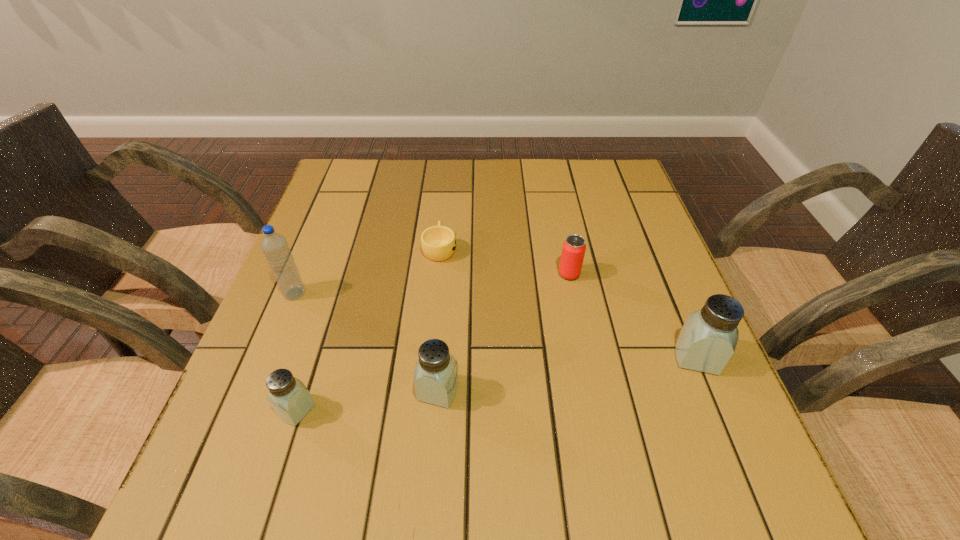
I want to click on the shortest saltshaker, so click(290, 399).

At what (x,y) coordinates should I click in order to perform the action: click on the leftmost saltshaker. Please return your answer as a coordinate pair (x, y). The image size is (960, 540). Looking at the image, I should click on pos(290,399).

Where is `the second saltshaker from left to right`? the second saltshaker from left to right is located at coordinates (436, 379).

I want to click on the third tallest object, so click(436, 379).

At what (x,y) coordinates should I click in order to perform the action: click on the second tallest object. Please return your answer as a coordinate pair (x, y). This screenshot has width=960, height=540. Looking at the image, I should click on (708, 338).

Identify the location of the tallest saltshaker. The height and width of the screenshot is (540, 960). (708, 338).

You are a GUI agent. You are given a task and a screenshot of the screen. Output one action in this format:
    pyautogui.click(x=<x>, y=<y>)
    Task: Click on the cup
    This screenshot has width=960, height=540.
    Given the screenshot: What is the action you would take?
    pyautogui.click(x=438, y=243)

At what (x,y) coordinates should I click in order to perform the action: click on the shortest object. Please return your answer as a coordinate pair (x, y). The height and width of the screenshot is (540, 960). Looking at the image, I should click on (438, 243).

What are the coordinates of `water bottle` in the screenshot? It's located at (275, 247).

The image size is (960, 540). In order to click on the third farthest object in this screenshot , I will do `click(275, 247)`.